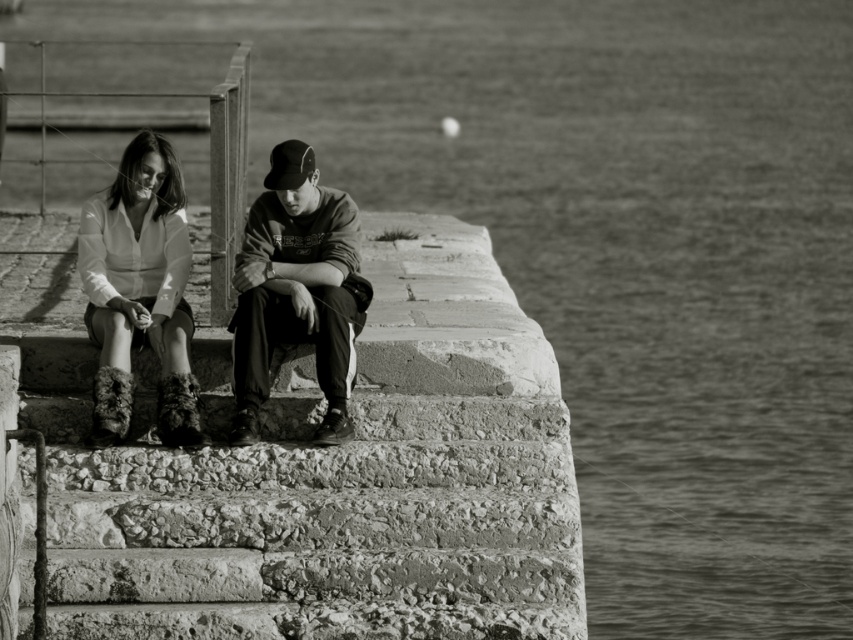
Between fluffy suede boots at lower left and dark gray sweatshirt at center, which one appears on the right side from the viewer's perspective?

fluffy suede boots at lower left is more to the right.

This screenshot has width=853, height=640. In order to click on fluffy suede boots at lower left in this screenshot , I will do `click(299, 289)`.

Between rough stone stairs at center and fuzzy fabric boots at lower left, which one is positioned higher?

Positioned higher is fuzzy fabric boots at lower left.

Does rough stone stairs at center appear on the right side of fuzzy fabric boots at lower left?

Correct, you'll find rough stone stairs at center to the right of fuzzy fabric boots at lower left.

Locate an element on the screen. Image resolution: width=853 pixels, height=640 pixels. rough stone stairs at center is located at coordinates (306, 516).

At what (x,y) coordinates should I click in order to perform the action: click on rough stone stairs at center. Please return your answer as a coordinate pair (x, y). The image size is (853, 640). Looking at the image, I should click on tap(306, 516).

Between rough stone stairs at center and dark gray sweatshirt at center, which one appears on the right side from the viewer's perspective?

dark gray sweatshirt at center

Between rough stone stairs at center and dark gray sweatshirt at center, which one is positioned higher?

dark gray sweatshirt at center is higher up.

Image resolution: width=853 pixels, height=640 pixels. What do you see at coordinates (306, 516) in the screenshot? I see `rough stone stairs at center` at bounding box center [306, 516].

Locate an element on the screen. The image size is (853, 640). rough stone stairs at center is located at coordinates (306, 516).